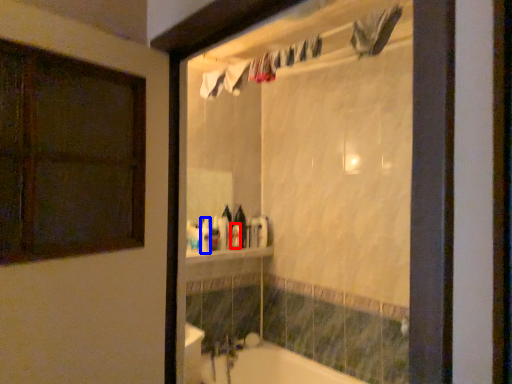
Question: Which of the following is the farthest to the observer, toiletry (highlighted by a red box) or toiletry (highlighted by a blue box)?

Choices:
 (A) toiletry
 (B) toiletry

Answer: (A)